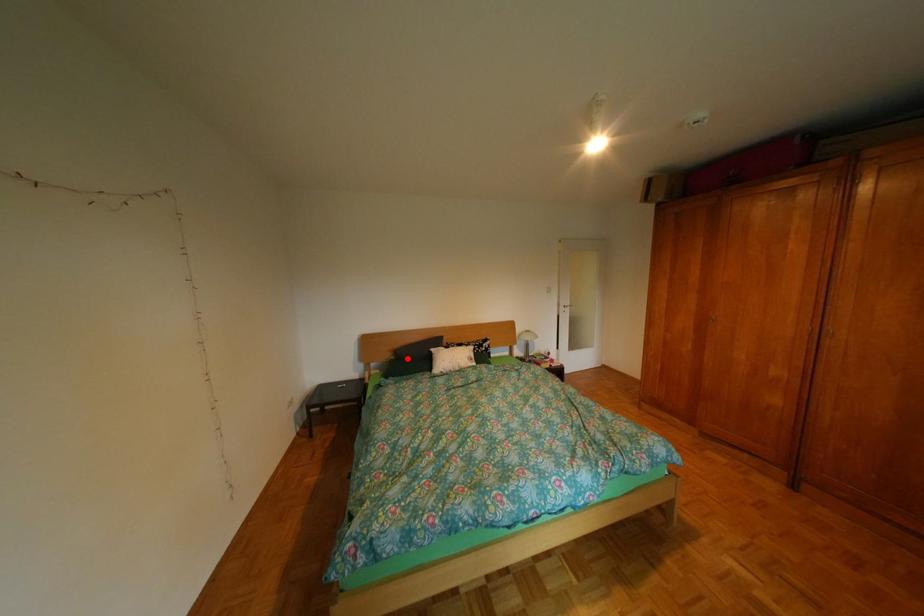
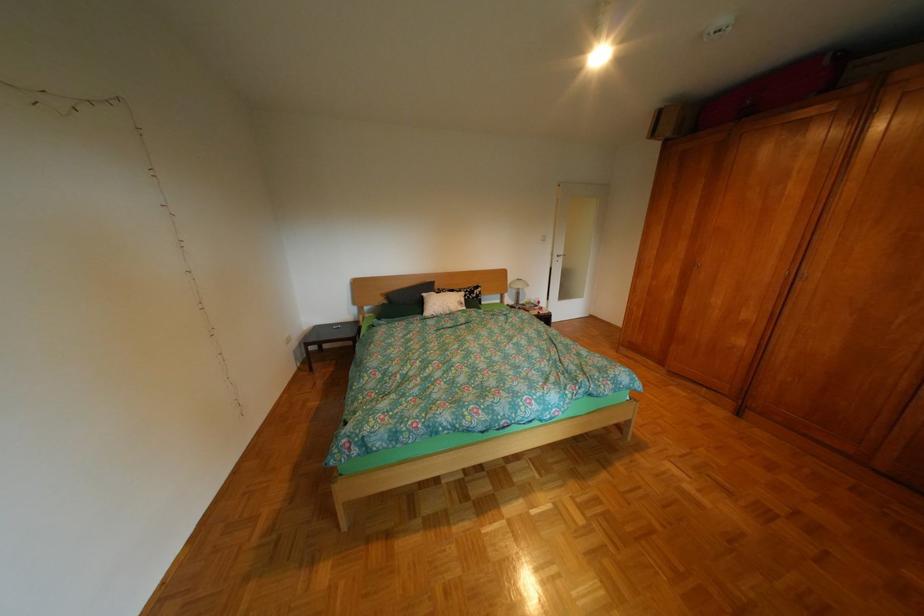
Locate, in the second image, the point that corresponds to the highlighted location in the first image.

(400, 302)